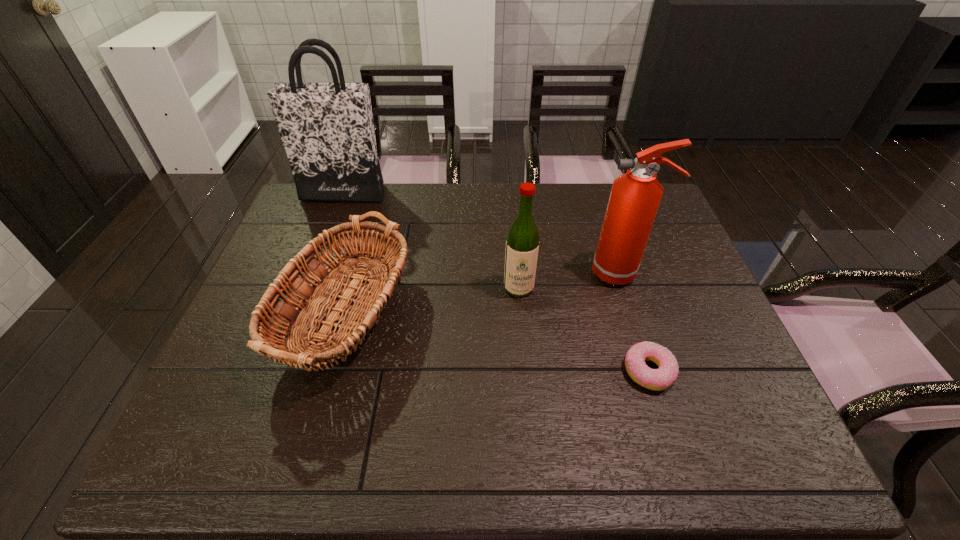
Where is `object that is positioned at the near left corner`? Image resolution: width=960 pixels, height=540 pixels. object that is positioned at the near left corner is located at coordinates coord(370,299).

Identify the location of vacant region at the far edge of the desktop. This screenshot has width=960, height=540. (599, 217).

Find the location of a particular element. The image size is (960, 540). free point at the left edge is located at coordinates (208, 386).

Identify the location of free region at the right edge of the desktop. (x=713, y=338).

Locate an element on the screen. Image resolution: width=960 pixels, height=540 pixels. vacant space at the near left corner is located at coordinates (177, 443).

In the image, there is a desktop. Where is `vacant space at the far right corner`? The height and width of the screenshot is (540, 960). vacant space at the far right corner is located at coordinates (662, 214).

In the image, there is a desktop. Where is `free space at the near right corner`? This screenshot has width=960, height=540. free space at the near right corner is located at coordinates 776,454.

The image size is (960, 540). Identify the location of vacant region between the fourth tallest object and the liquor. (427, 305).

You are a GUI agent. You are given a task and a screenshot of the screen. Output one action in this format:
    pyautogui.click(x=<x>, y=<y>)
    Task: Click on the blank region between the third object from left to right and the shortest object
    The image size is (960, 540).
    Given the screenshot: What is the action you would take?
    pyautogui.click(x=584, y=329)

Find the location of a particular element. free space between the shortest object and the farthest object is located at coordinates (496, 282).